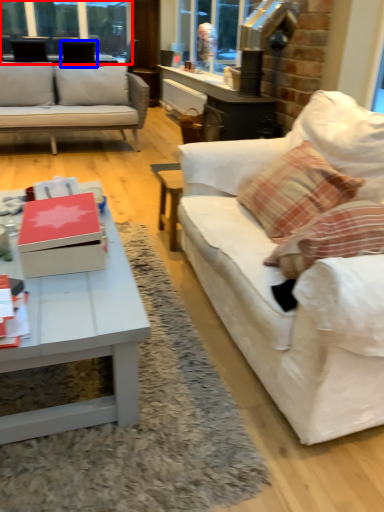
Question: Which point is further to the camera, window frame (highlighted by a red box) or armchair (highlighted by a blue box)?

Choices:
 (A) window frame
 (B) armchair

Answer: (A)